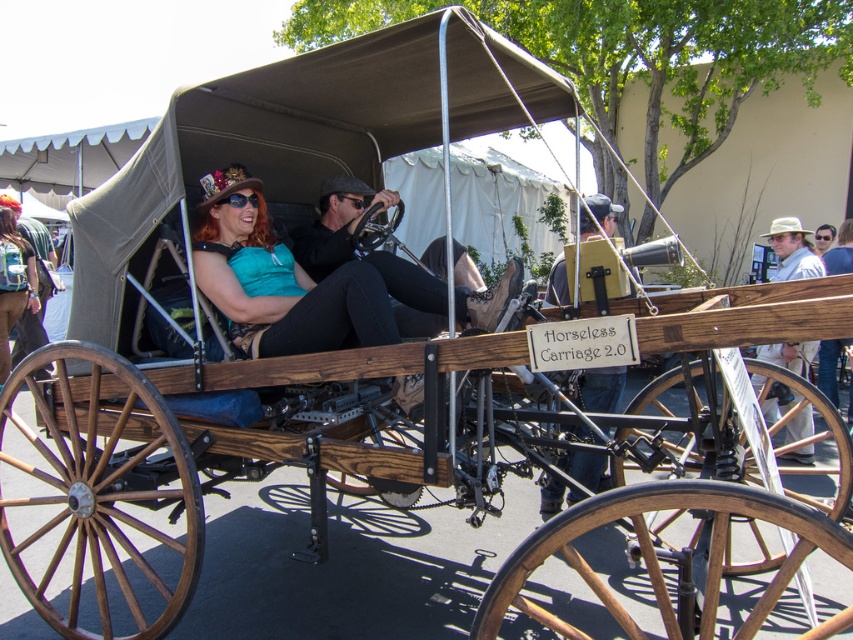
The width and height of the screenshot is (853, 640). Describe the element at coordinates (601, 387) in the screenshot. I see `wooden signboard at center` at that location.

You are a GUI agent. You are given a task and a screenshot of the screen. Output one action in this format:
    pyautogui.click(x=<x>, y=<y>)
    Task: Click on the wooden signboard at center
    This screenshot has width=853, height=640.
    Given the screenshot: What is the action you would take?
    pyautogui.click(x=601, y=387)

Is point (560, 259) positioned in front of point (787, 257)?

Yes, it is in front of point (787, 257).

Locate an element on the screen. Image resolution: width=853 pixels, height=640 pixels. wooden signboard at center is located at coordinates (601, 387).

Is matte black leather steering wheel at center further to camera compared to light brown straw hat at upper right?

No, matte black leather steering wheel at center is in front of light brown straw hat at upper right.

Can you confirm if matte black leather steering wheel at center is wider than light brown straw hat at upper right?

Yes, matte black leather steering wheel at center is wider than light brown straw hat at upper right.

Measure the distance between point [300,252] and camera.

4.39 meters

Where is `matte black leather steering wheel at center`? This screenshot has height=640, width=853. matte black leather steering wheel at center is located at coordinates (334, 225).

Can you confirm if light brown straw hat at upper right is positioned to the left of matte black backpack at left?

No, light brown straw hat at upper right is not to the left of matte black backpack at left.

Is point (805, 266) closer to camera compared to point (4, 321)?

Yes, it is in front of point (4, 321).

Where is `light brown straw hat at upper right`? The height and width of the screenshot is (640, 853). light brown straw hat at upper right is located at coordinates (792, 250).